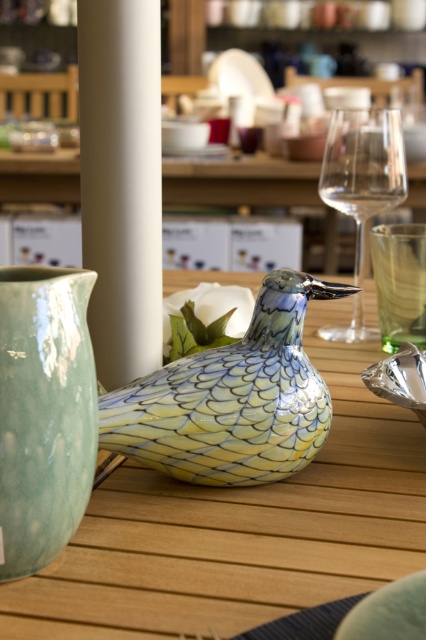
Question: Estimate the real-world distances between objects in this image. Which object is closer to the porcelain bird at center?

Choices:
 (A) shiny ceramic bird at center
 (B) matte green vase at left
 (C) white smooth pillar at center
 (D) transparent glass wine glass at upper right

Answer: (A)

Question: Which object is positioned closest to the transparent glass at center?

Choices:
 (A) transparent glass wine glass at upper right
 (B) shiny ceramic bird at center
 (C) porcelain bird at center

Answer: (A)

Question: Among these objects, which one is farthest from the camera?

Choices:
 (A) transparent glass at center
 (B) shiny ceramic bird at center
 (C) transparent glass wine glass at upper right

Answer: (C)

Question: Can you confirm if porcelain bird at center is positioned to the right of transparent glass at center?

Choices:
 (A) yes
 (B) no

Answer: (B)

Question: Can you confirm if transparent glass wine glass at upper right is positioned below transparent glass at center?

Choices:
 (A) yes
 (B) no

Answer: (B)

Question: Does matte green vase at left have a lesser width compared to transparent glass at center?

Choices:
 (A) no
 (B) yes

Answer: (B)